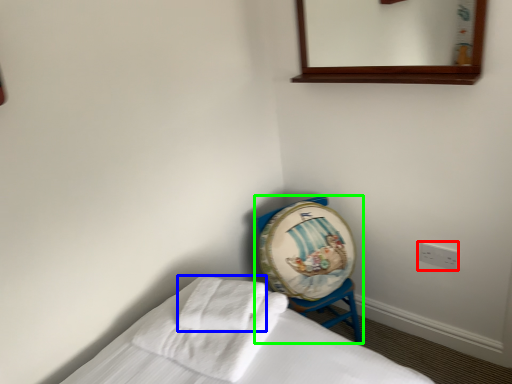
Question: Which is nearer to the electric outlet (highlighted by a red box)? bath towel (highlighted by a blue box) or furniture (highlighted by a green box).

Choices:
 (A) bath towel
 (B) furniture

Answer: (B)